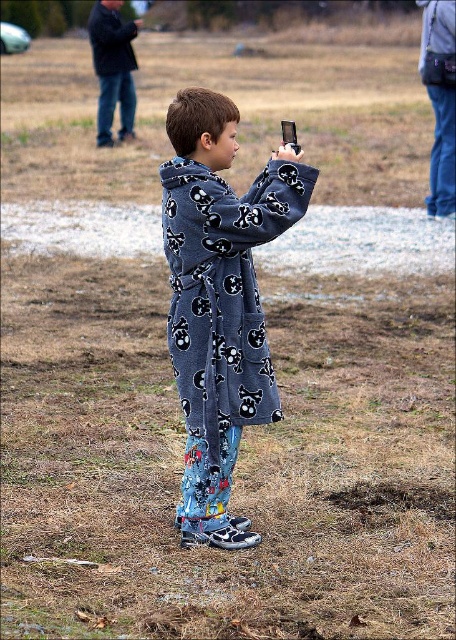
You are a photographer trying to capture the scene in the image. You notice the dark gray fleece robe at upper left and the metallic silver phone at upper center. Based on their sizes in the image, which object would you need to focus on more carefully to ensure it appears sharp in the photo?

The dark gray fleece robe at upper left is larger than the metallic silver phone at upper center, so you would need to focus more carefully on the metallic silver phone at upper center to ensure it appears sharp since smaller objects might require precise focus.